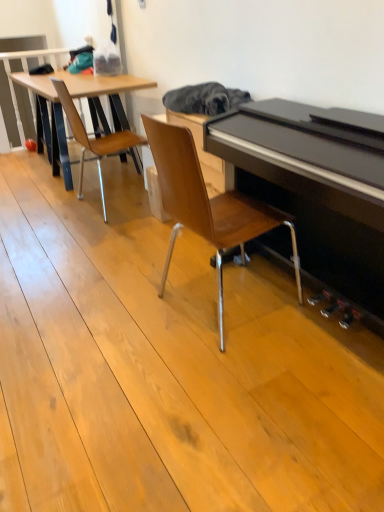
The width and height of the screenshot is (384, 512). In order to click on free spot in front of wooden chair at center, arranged as the 1th chair when viewed from the right in this screenshot , I will do `click(235, 389)`.